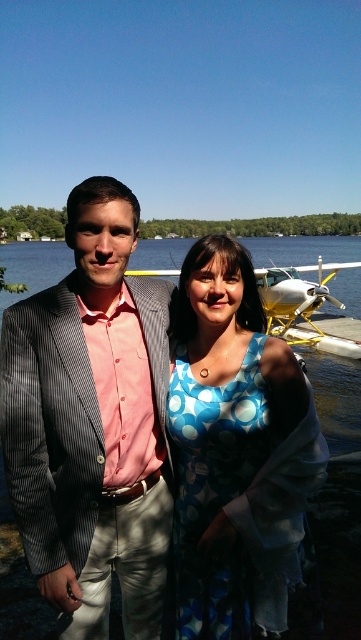
Question: Does matte pink shirt at center appear on the right side of clear water at center?

Choices:
 (A) yes
 (B) no

Answer: (B)

Question: Is matte pink shirt at center positioned in front of clear water at center?

Choices:
 (A) yes
 (B) no

Answer: (A)

Question: Estimate the real-world distances between objects in this image. Which object is farther from the blue dotted dress at center?

Choices:
 (A) clear water at center
 (B) matte pink shirt at center

Answer: (A)

Question: Among these objects, which one is farthest from the camera?

Choices:
 (A) clear water at center
 (B) matte pink shirt at center

Answer: (A)

Question: Among these points, which one is nearest to the camera?

Choices:
 (A) (98, 552)
 (B) (210, 298)

Answer: (A)

Question: Is matte pink shirt at center bigger than blue dotted dress at center?

Choices:
 (A) yes
 (B) no

Answer: (A)